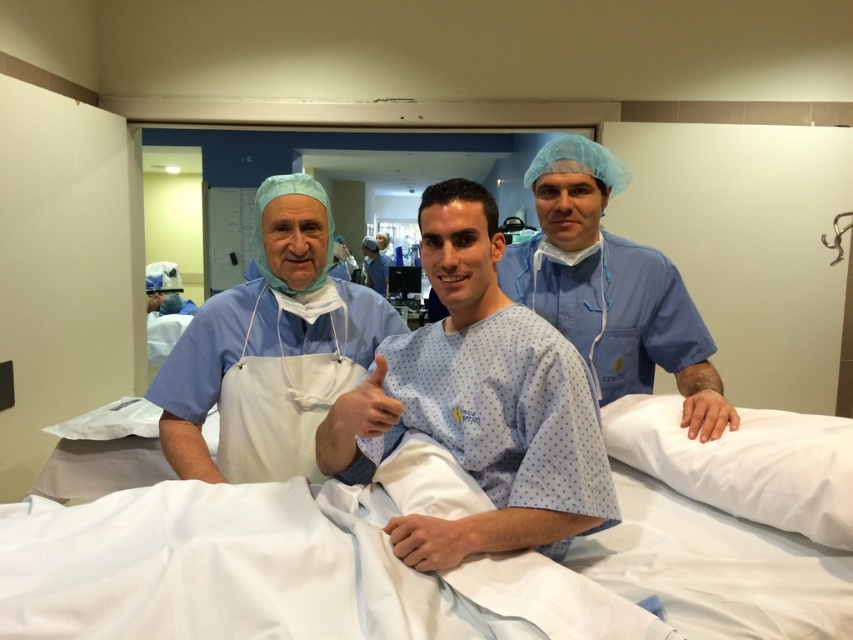
You are a nurse in a hospital. You need to determine which garment is shorter between the blue fabric hospital gown at center and the blue surgical gown at center. Which one should you choose?

The blue fabric hospital gown at center is shorter than the blue surgical gown at center, so you should choose the blue fabric hospital gown at center if you need a shorter garment.

You are a nurse in a hospital room. You see a white matte apron at center and a blue surgical gown at center. Which one is positioned lower in the scene?

The white matte apron at center is located below the blue surgical gown at center, so the white matte apron at center is positioned lower in the scene.